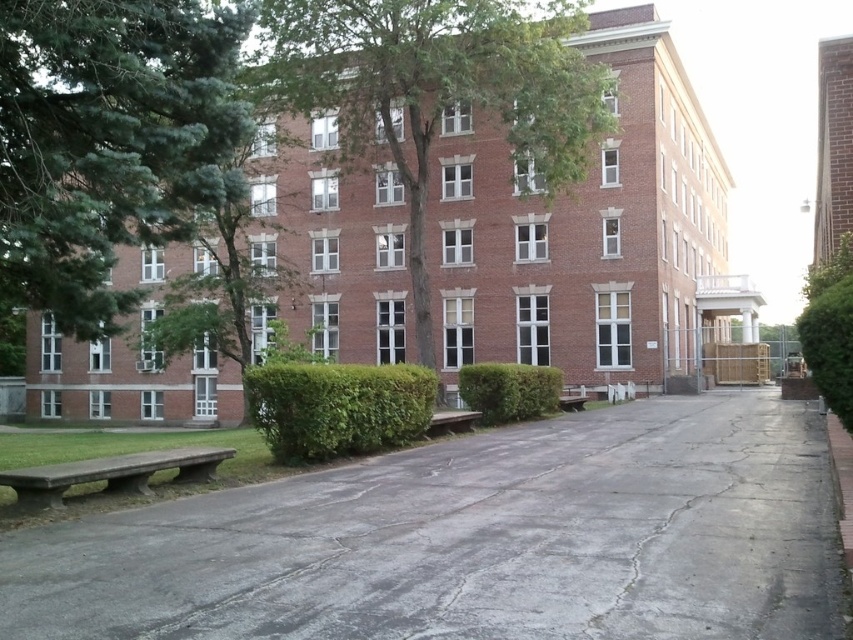
You are a visitor arriving at the building and want to sit down. You see the concrete bench at lower left and the brown wooden bench at center. Which bench is closer to the entrance of the building?

The concrete bench at lower left is closer to the entrance because it is positioned to the left of the brown wooden bench at center, which is further away from the entrance.